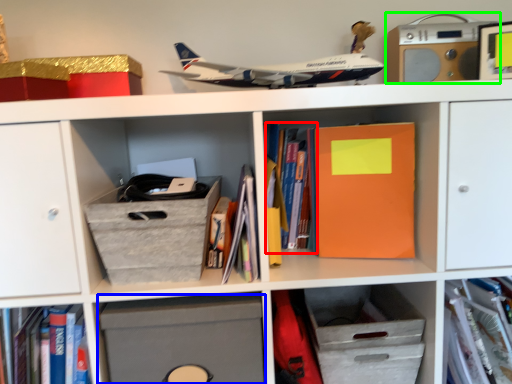
Question: Estimate the real-world distances between objects in this image. Which object is closer to book (highlighted by a red box), cabinet (highlighted by a blue box) or stereo (highlighted by a green box)?

Choices:
 (A) cabinet
 (B) stereo

Answer: (A)